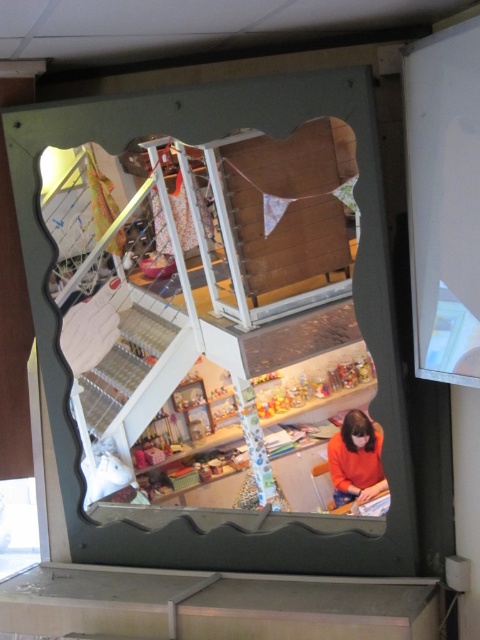
Question: Does clear glass mirror at center appear under orange matte sweater at lower right?

Choices:
 (A) yes
 (B) no

Answer: (B)

Question: Which point is farther to the camera?

Choices:
 (A) (73, 275)
 (B) (340, 454)

Answer: (B)

Question: Which point is closer to the camera?

Choices:
 (A) (362, 486)
 (B) (229, 372)

Answer: (A)

Question: Can you confirm if clear glass mirror at center is positioned to the right of orange matte sweater at lower right?

Choices:
 (A) no
 (B) yes

Answer: (A)

Question: Among these points, which one is farthest from the camera?

Choices:
 (A) (172, 250)
 (B) (371, 452)

Answer: (B)

Question: Is clear glass mirror at center positioned behind orange matte sweater at lower right?

Choices:
 (A) no
 (B) yes

Answer: (A)